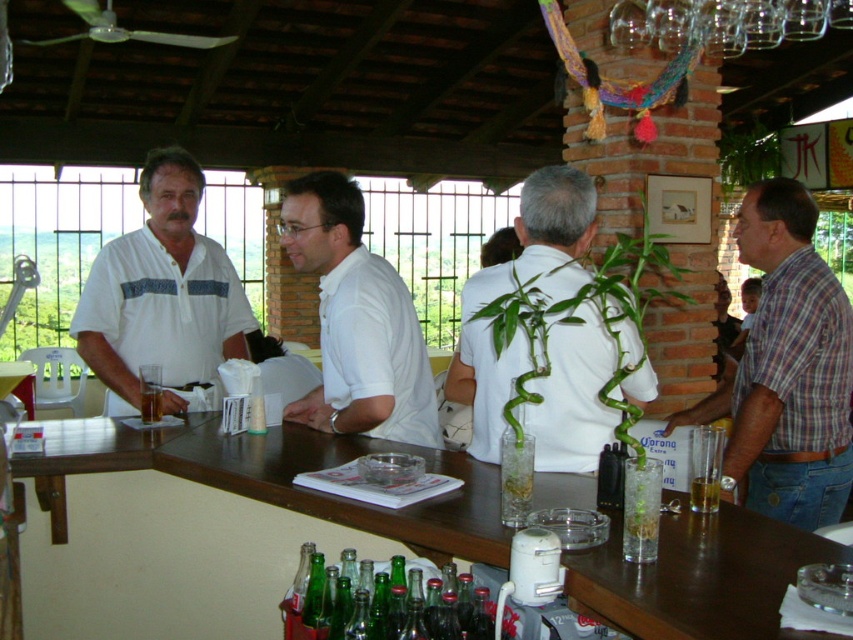
Question: Can you confirm if white matte plant at center is wider than green glass bottles at center?

Choices:
 (A) no
 (B) yes

Answer: (B)

Question: Is white matte shirt at left to the right of translucent glass beer at bar center from the viewer's perspective?

Choices:
 (A) no
 (B) yes

Answer: (A)

Question: From the image, what is the correct spatial relationship of white matte shirt at center in relation to green glass bottles at center?

Choices:
 (A) right
 (B) left

Answer: (B)

Question: Which of the following is the farthest from the observer?

Choices:
 (A) (695, 484)
 (B) (144, 420)

Answer: (B)

Question: Which point is farther to the camera?

Choices:
 (A) white matte shirt at left
 (B) green glass bottles at center
 (C) translucent glass beer at bar center

Answer: (A)

Question: Which point is farther to the camera?

Choices:
 (A) (339, 401)
 (B) (784, 284)
 (C) (698, 481)
 (D) (584, 438)

Answer: (A)